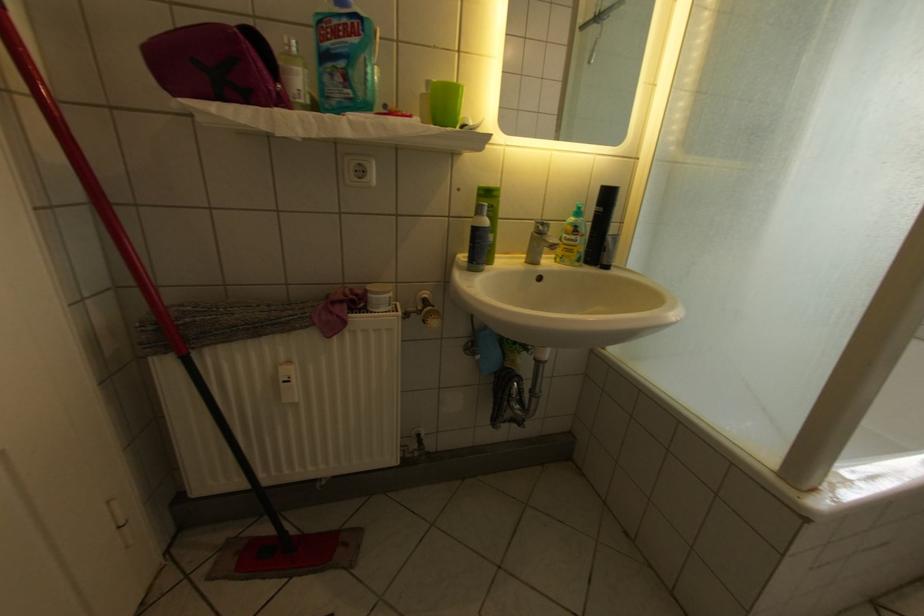
Which object does [600,224] point to?

It corresponds to the black spray can in the image.